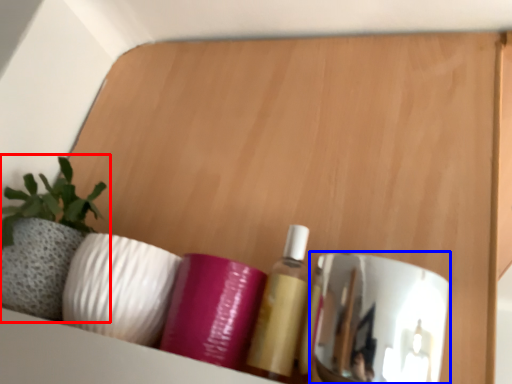
Question: Which of the following is the closest to the observer, houseplant (highlighted by a red box) or mirror (highlighted by a blue box)?

Choices:
 (A) houseplant
 (B) mirror

Answer: (B)